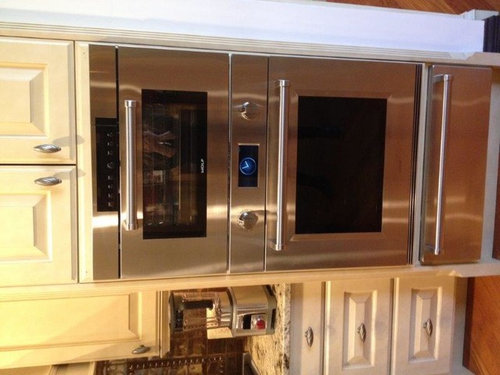
In order to click on drawer pull in this screenshot , I will do `click(307, 339)`, `click(365, 337)`, `click(429, 326)`.